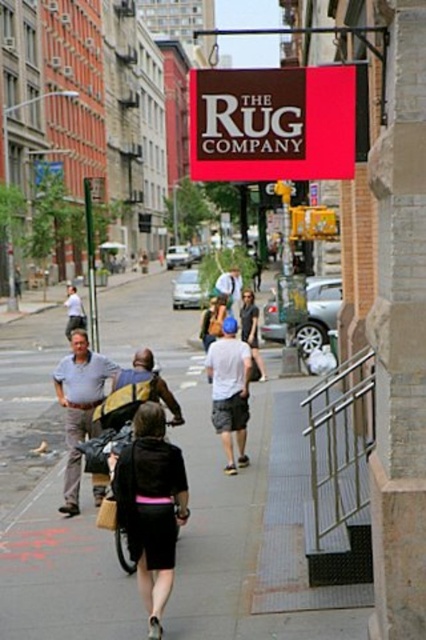
Question: Is matte brown sign at upper center above light blue shirt at center?

Choices:
 (A) yes
 (B) no

Answer: (A)

Question: Among these objects, which one is farthest from the camera?

Choices:
 (A) gray concrete sidewalk at center
 (B) black matte shorts at center
 (C) light blue shirt at center

Answer: (C)

Question: Which is farther from the white cotton t-shirt at center?

Choices:
 (A) gray concrete sidewalk at center
 (B) light blue shirt at center

Answer: (A)

Question: Which of the following is the closest to the observer?

Choices:
 (A) matte brown sign at upper center
 (B) light blue shirt at center
 (C) black matte shorts at center
 (D) gray concrete sidewalk at center

Answer: (C)

Question: Does matte brown sign at upper center have a larger size compared to black matte shorts at center?

Choices:
 (A) no
 (B) yes

Answer: (B)

Question: Can you confirm if matte brown sign at upper center is positioned below white cotton t-shirt at center?

Choices:
 (A) yes
 (B) no

Answer: (B)